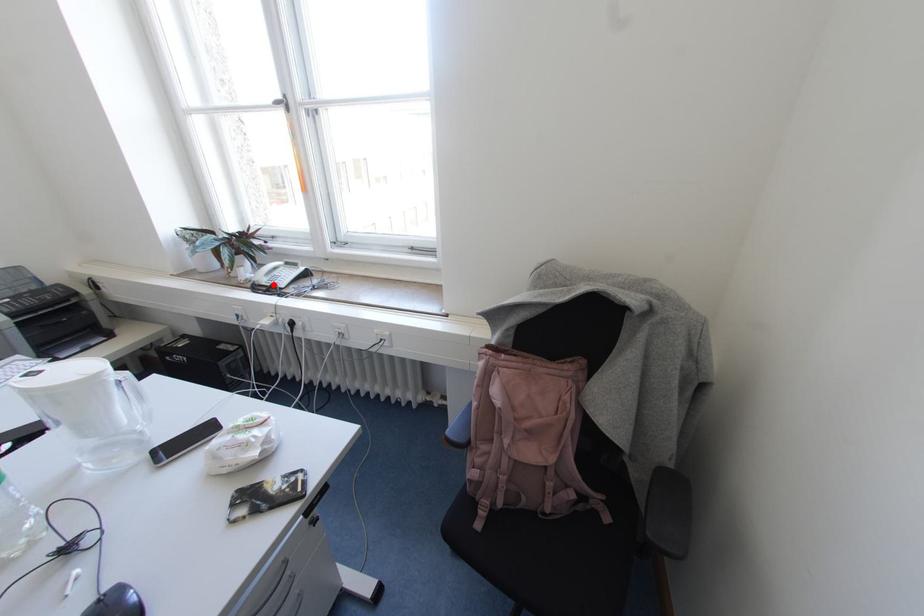
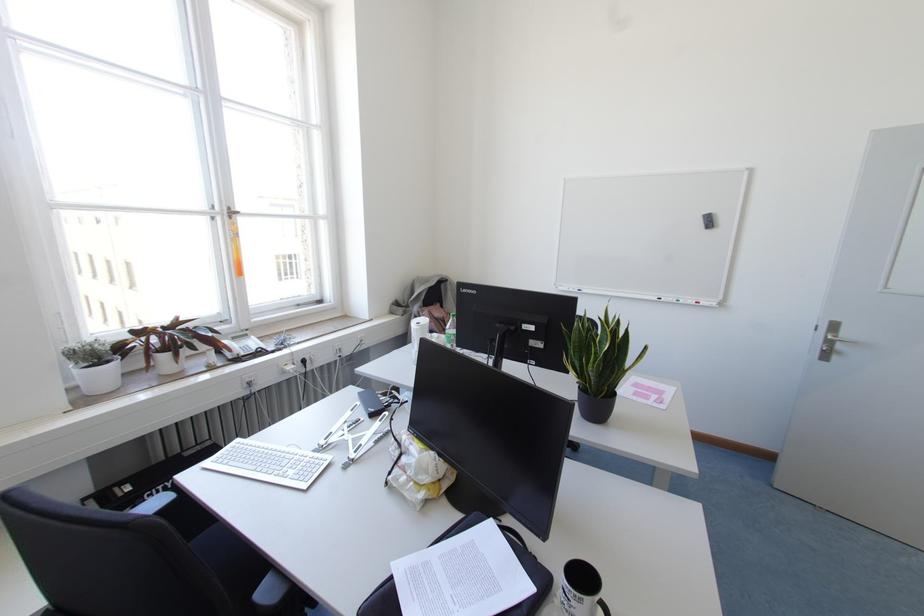
Where in the second image is the point corresponding to the highlighted location from the first image?

(258, 349)